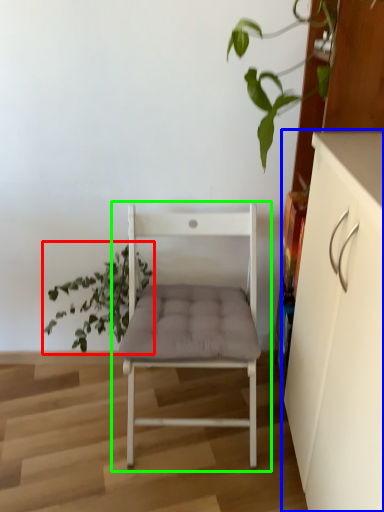
Question: Which is farther away from houseplant (highlighted by a red box)? cabinetry (highlighted by a blue box) or chair (highlighted by a green box)?

Choices:
 (A) cabinetry
 (B) chair

Answer: (A)